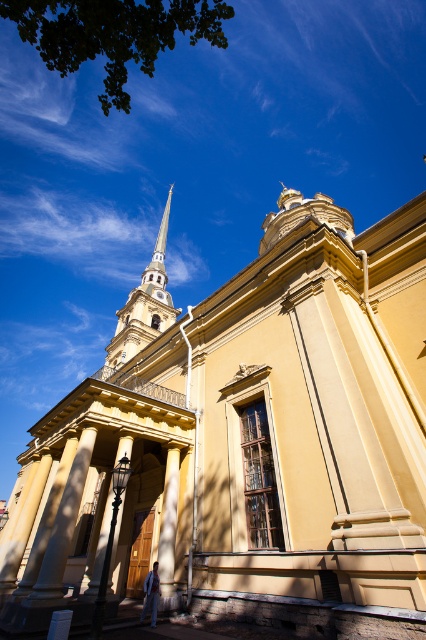
You are an architect examining the building from the ground level. You notice two spires on the building. Which spire, the golden spire at upper left or the polished silver spire at upper center, appears narrower when viewed from your current position?

The golden spire at upper left appears narrower than the polished silver spire at upper center.

You are standing at the entrance of the yellow matte church at center and want to take a photo of the smooth beige column at lower left. Since you have a standard camera with a 50mm lens, which is better suited for capturing tall structures, will the column fit in the frame if you aim directly at it from this position?

The yellow matte church at center is taller than the smooth beige column at lower left. Since the camera lens is optimized for tall structures like the church, it should easily capture the shorter column in the frame when aimed directly.

Please provide the coordinates of the golden spire at upper left in the image.

The golden spire at upper left is located at coordinates point (144, 305).